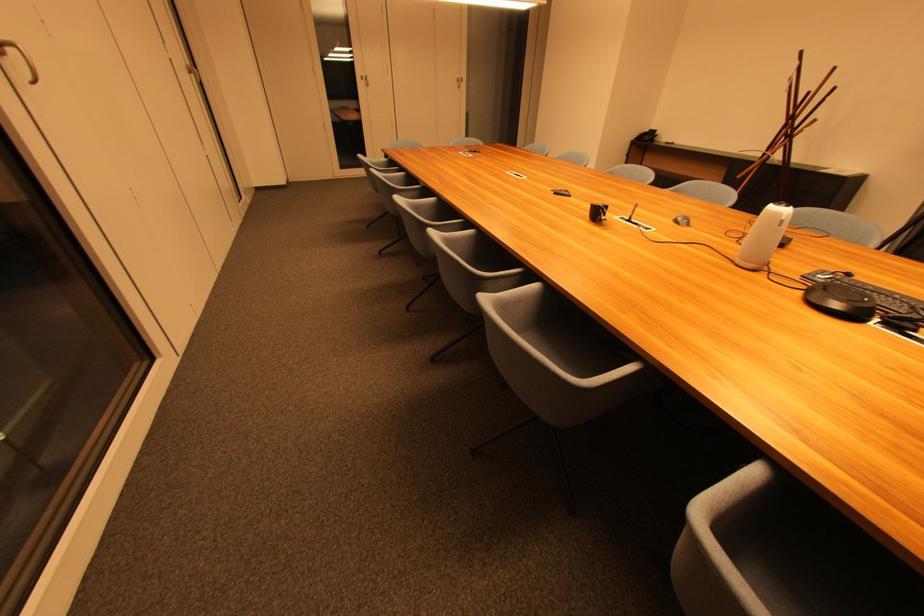
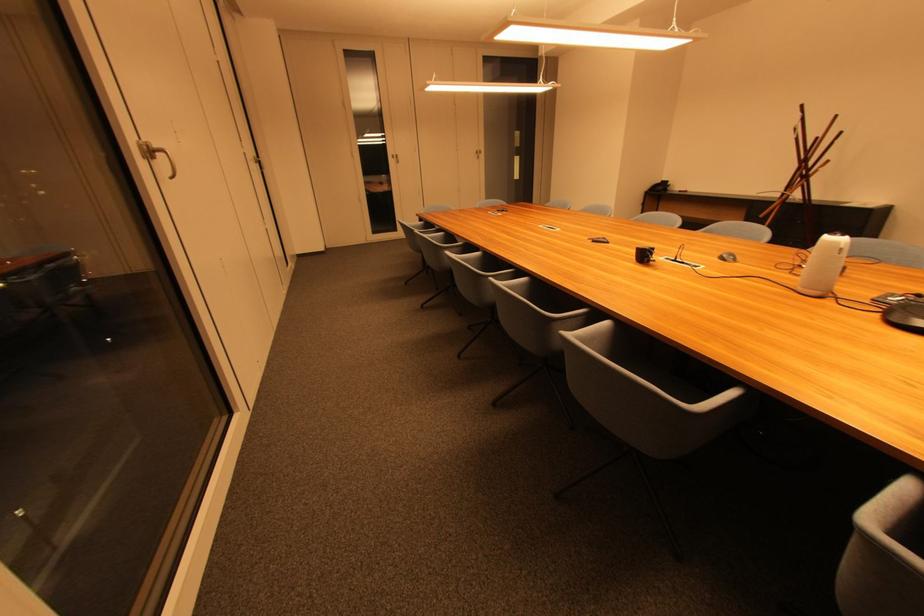
The point at (784, 216) is marked in the first image. Where is the corresponding point in the second image?

(841, 245)